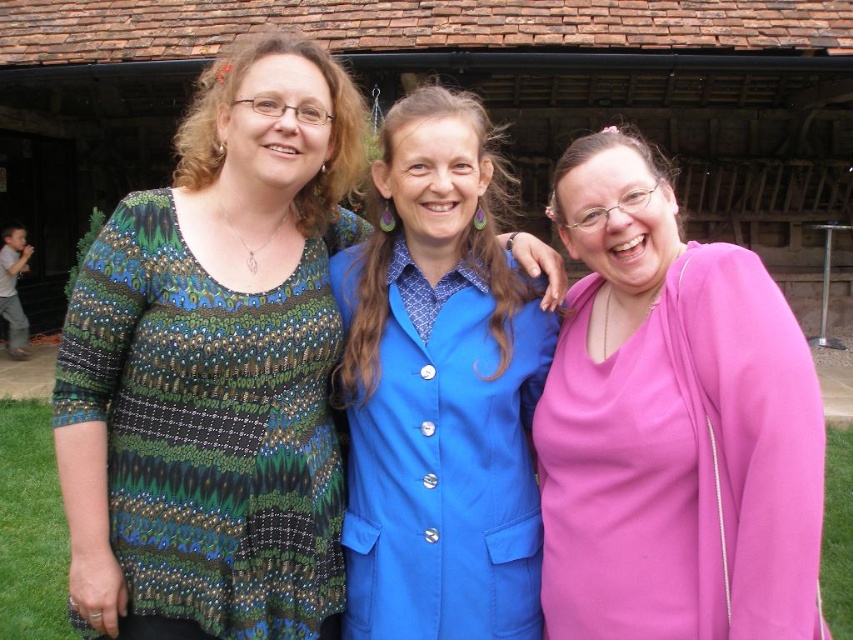
You are a photographer trying to capture a clear shot of both the multicolored textured blouse at center and the blue satin blazer at center. Given that your camera can focus on objects within a 50 cm range, will you be able to capture both in focus?

The multicolored textured blouse at center is 52.17 centimeters from the blue satin blazer at center. Since the distance exceeds the camera focus range of 50 cm, both items cannot be in focus simultaneously.

You are a photographer trying to capture the best angle of the two central outfits in the image. The multicolored textured blouse at center and the pink satin dress at center. Which outfit is more visible in the photo?

The multicolored textured blouse at center is positioned over the pink satin dress at center, so the blouse is more visible in the photo.